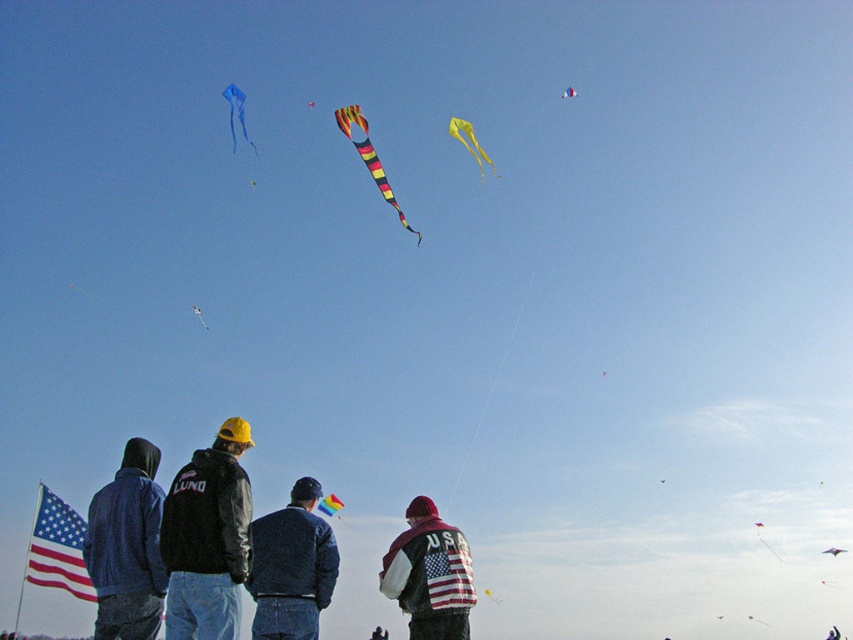
Question: Which object appears closest to the camera in this image?

Choices:
 (A) blue fabric kite at upper left
 (B) american flag at lower left
 (C) denim jacket at center
 (D) yellow striped kite at upper center

Answer: (C)

Question: Is american flag patterned jacket at center closer to camera compared to matte yellow kite at upper center?

Choices:
 (A) no
 (B) yes

Answer: (B)

Question: Which object is closer to the camera taking this photo?

Choices:
 (A) black leather jacket at lower left
 (B) blue and white striped kite at upper center
 (C) blue fabric kite at upper left
 (D) yellow fabric kite at upper center

Answer: (A)

Question: Which object is the farthest from the translucent purple kite at upper center?

Choices:
 (A) american flag patterned jacket at center
 (B) blue and white striped kite at upper center
 (C) yellow fabric kite at upper center

Answer: (A)

Question: Is american flag patterned jacket at center thinner than yellow fabric kite at upper center?

Choices:
 (A) no
 (B) yes

Answer: (B)

Question: Is black leather jacket at lower left to the left of american flag at lower left from the viewer's perspective?

Choices:
 (A) yes
 (B) no

Answer: (B)